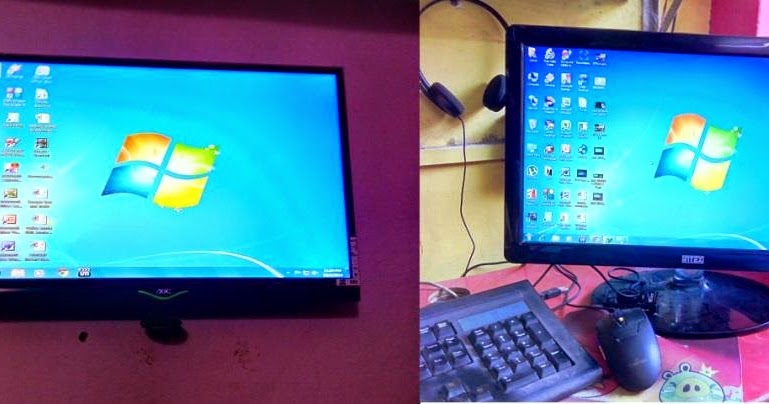
Find the location of a particular element. Image resolution: width=769 pixels, height=404 pixels. computer screen is located at coordinates (271, 210), (676, 193).